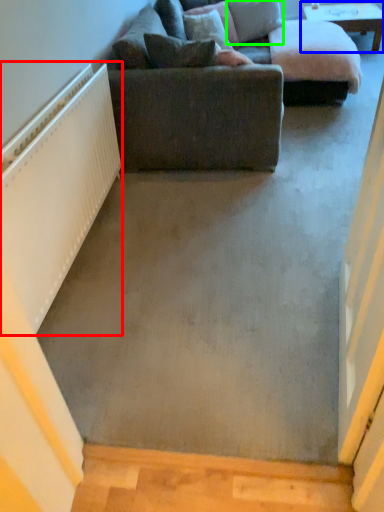
Question: Which is farther away from radiator (highlighted by a red box)? table (highlighted by a blue box) or pillow (highlighted by a green box)?

Choices:
 (A) table
 (B) pillow

Answer: (A)